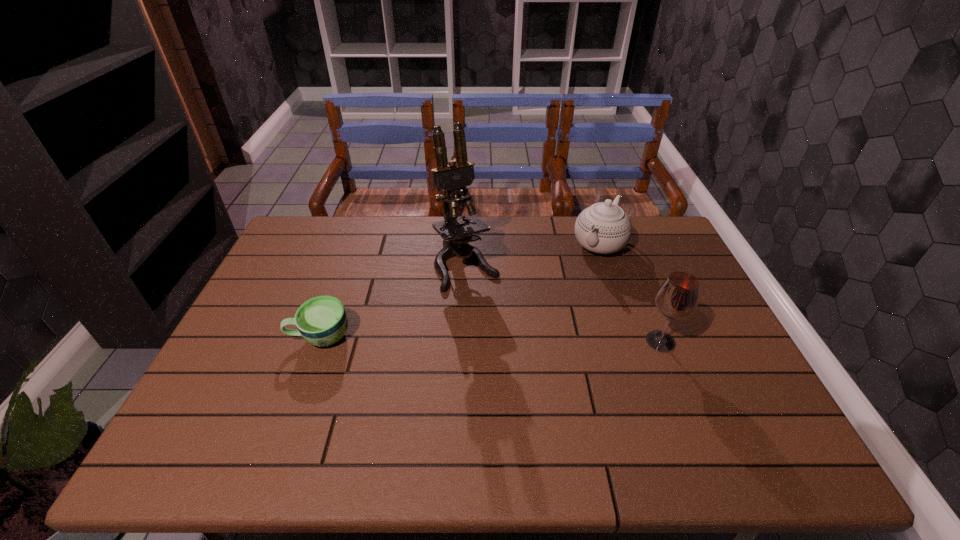
Locate an element on the screen. vacant space on the desktop that is between the cup and the second tallest object and is positioned on the spout of the second shortest object is located at coordinates (526, 340).

Locate an element on the screen. free space on the desktop that is between the cup and the second tallest object and is positioned at the eyepieces of the third object from right to left is located at coordinates (511, 339).